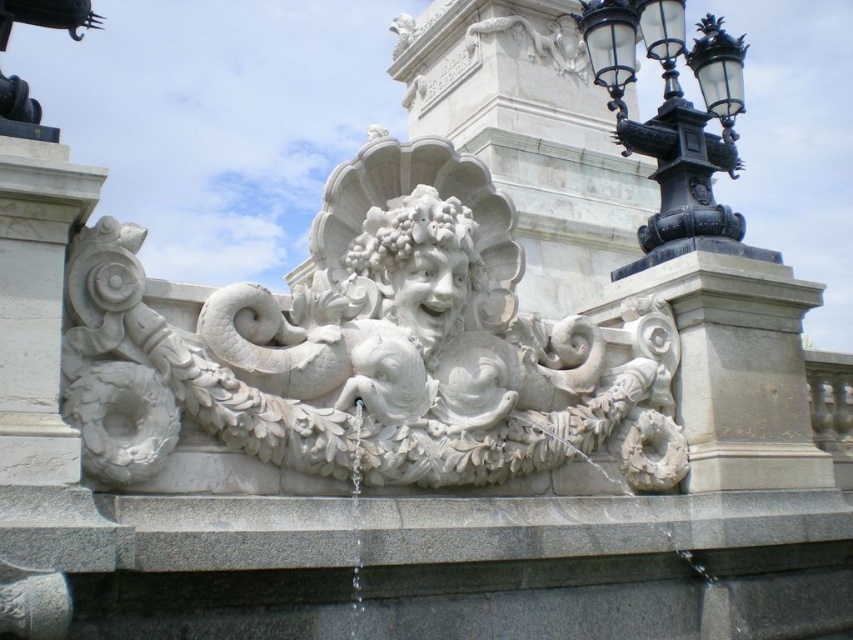
Between white marble sculpture at center and black metal/texture lamp post at upper right, which one has less height?

Standing shorter between the two is white marble sculpture at center.

Locate an element on the screen. white marble sculpture at center is located at coordinates pyautogui.click(x=370, y=349).

You are a GUI agent. You are given a task and a screenshot of the screen. Output one action in this format:
    pyautogui.click(x=<x>, y=<y>)
    Task: Click on the white marble sculpture at center
    
    Given the screenshot: What is the action you would take?
    pyautogui.click(x=370, y=349)

In order to click on white marble sculpture at center in this screenshot , I will do `click(370, 349)`.

Is white marble sculpture at center positioned in front of white stone deity at center?

That is True.

Who is more forward, (213, 392) or (419, 316)?

Positioned in front is point (213, 392).

Who is more forward, (459, 296) or (380, 289)?

Point (380, 289)

Locate an element on the screen. This screenshot has width=853, height=640. white marble sculpture at center is located at coordinates (370, 349).

Who is more forward, (614, 49) or (387, 243)?

Point (387, 243) is in front.

Is point (619, 24) farther from viewer compared to point (387, 230)?

Yes, it is behind point (387, 230).

Who is more distant from viewer, (614,61) or (412,260)?

Positioned behind is point (614,61).

You are a GUI agent. You are given a task and a screenshot of the screen. Output one action in this format:
    pyautogui.click(x=<x>, y=<y>)
    Task: Click on the black metal/texture lamp post at upper right
    The height and width of the screenshot is (640, 853).
    Given the screenshot: What is the action you would take?
    pyautogui.click(x=674, y=118)